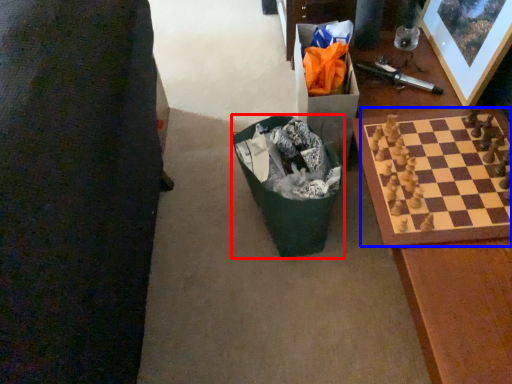
Question: Which object appears closest to the camera in this image, recycling bin (highlighted by a red box) or board game (highlighted by a blue box)?

Choices:
 (A) recycling bin
 (B) board game

Answer: (B)